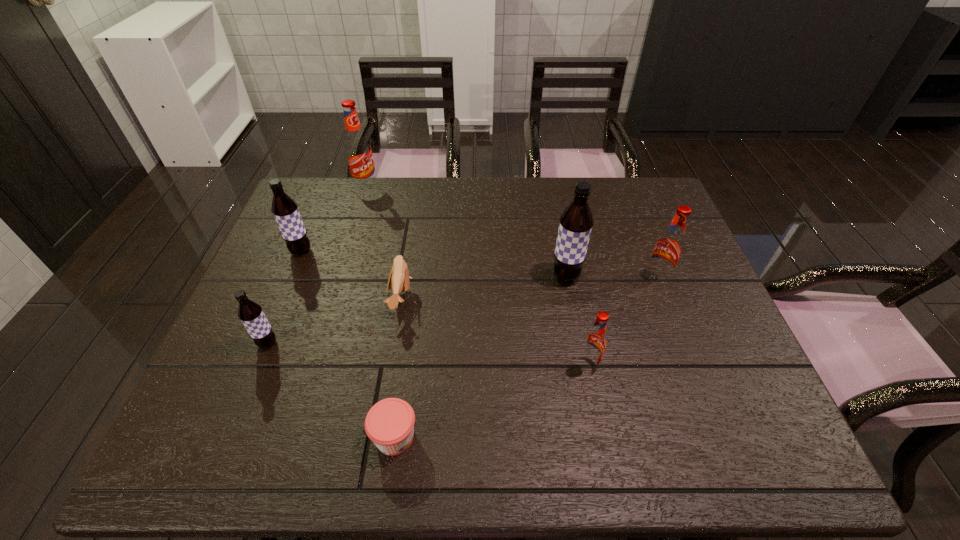
Locate an element on the screen. The image size is (960, 540). vacant space located 0.070m on the back of the nearest red root beer is located at coordinates (582, 332).

You are a GUI agent. You are given a task and a screenshot of the screen. Output one action in this format:
    pyautogui.click(x=<x>, y=<y>)
    Task: Click on the free region located 0.070m at the beak of the bird
    This screenshot has width=960, height=540.
    Given the screenshot: What is the action you would take?
    tap(439, 299)

Locate an element on the screen. The height and width of the screenshot is (540, 960). vacant area situated on the front label of the jam is located at coordinates (571, 437).

The image size is (960, 540). Find the location of `object that is at the far edge`. object that is at the far edge is located at coordinates (358, 151).

Find the location of `object located at the near edge`. object located at the near edge is located at coordinates (390, 422).

At what (x,y) coordinates should I click in order to perform the action: click on object at the right edge. Please return your answer as a coordinate pair (x, y). The width and height of the screenshot is (960, 540). Looking at the image, I should click on (669, 247).

Where is `free spot at the far edge of the desktop`? free spot at the far edge of the desktop is located at coordinates (553, 180).

I want to click on vacant space at the left edge, so click(271, 289).

You are a GUI agent. You are given a task and a screenshot of the screen. Output one action in this format:
    pyautogui.click(x=<x>, y=<y>)
    Task: Click on the vacant space at the right edge
    The width and height of the screenshot is (960, 540).
    Given the screenshot: What is the action you would take?
    pyautogui.click(x=719, y=422)

This screenshot has height=540, width=960. I want to click on vacant space at the far left corner, so click(313, 214).